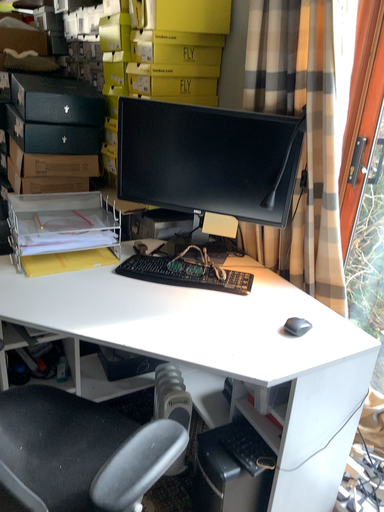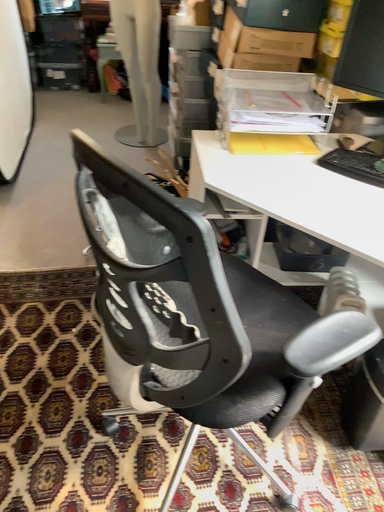
Question: How did the camera likely rotate when shooting the video?

Choices:
 (A) rotated left
 (B) rotated right

Answer: (A)